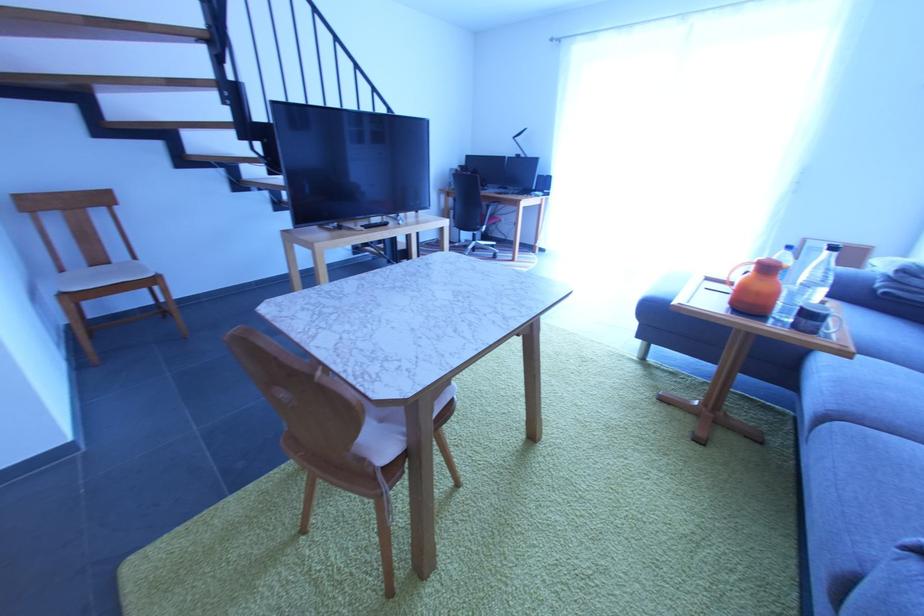
What do you see at coordinates (857, 464) in the screenshot? I see `the blue sofa sitting surface` at bounding box center [857, 464].